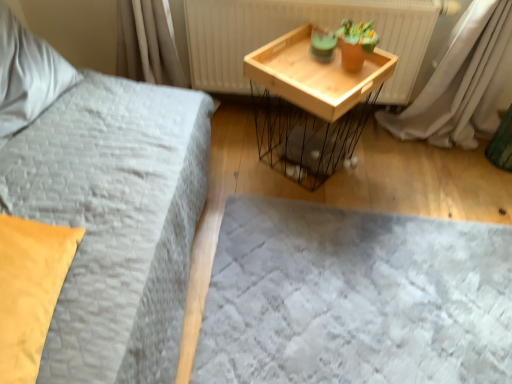
What are the coordinates of `vacant space behind soft gray fabric bed frame at lower center` in the screenshot? It's located at (364, 165).